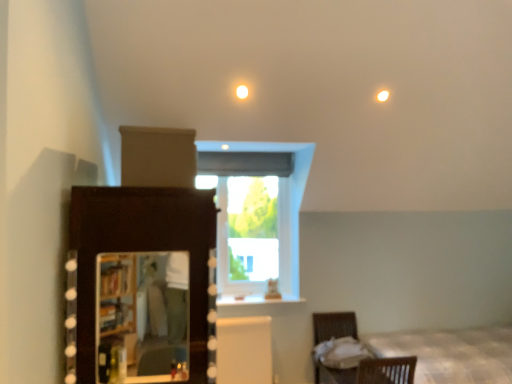
Question: Does transparent glass window at center have a larger size compared to matte wooden mirror at lower left?

Choices:
 (A) no
 (B) yes

Answer: (B)

Question: Can you confirm if transparent glass window at center is shorter than matte wooden mirror at lower left?

Choices:
 (A) yes
 (B) no

Answer: (B)

Question: Is transparent glass window at center directly adjacent to matte wooden mirror at lower left?

Choices:
 (A) yes
 (B) no

Answer: (B)

Question: Is transparent glass window at center looking in the opposite direction of matte wooden mirror at lower left?

Choices:
 (A) yes
 (B) no

Answer: (B)

Question: Considering the relative positions of transparent glass window at center and matte wooden mirror at lower left in the image provided, is transparent glass window at center to the right of matte wooden mirror at lower left from the viewer's perspective?

Choices:
 (A) yes
 (B) no

Answer: (A)

Question: In terms of height, does matte wooden mirror at lower left look taller or shorter compared to white fabric at lower right?

Choices:
 (A) tall
 (B) short

Answer: (A)

Question: Considering the positions of matte wooden mirror at lower left and white fabric at lower right in the image, is matte wooden mirror at lower left wider or thinner than white fabric at lower right?

Choices:
 (A) thin
 (B) wide

Answer: (A)

Question: Looking at the image, does matte wooden mirror at lower left seem bigger or smaller compared to white fabric at lower right?

Choices:
 (A) small
 (B) big

Answer: (A)

Question: From a real-world perspective, is matte wooden mirror at lower left physically located above or below white fabric at lower right?

Choices:
 (A) above
 (B) below

Answer: (A)

Question: Considering the positions of dark wood dresser at left and transparent glass window at center in the image, is dark wood dresser at left bigger or smaller than transparent glass window at center?

Choices:
 (A) small
 (B) big

Answer: (B)

Question: Does point (110, 233) appear closer or farther from the camera than point (236, 208)?

Choices:
 (A) closer
 (B) farther

Answer: (A)

Question: Considering the positions of dark wood dresser at left and transparent glass window at center in the image, is dark wood dresser at left wider or thinner than transparent glass window at center?

Choices:
 (A) wide
 (B) thin

Answer: (A)

Question: From a real-world perspective, is dark wood dresser at left above or below transparent glass window at center?

Choices:
 (A) below
 (B) above

Answer: (A)

Question: Is white fabric at lower right in front of or behind brown wicker basket at lower right in the image?

Choices:
 (A) front
 (B) behind

Answer: (B)

Question: Is point (314, 352) positioned closer to the camera than point (317, 375)?

Choices:
 (A) closer
 (B) farther

Answer: (B)